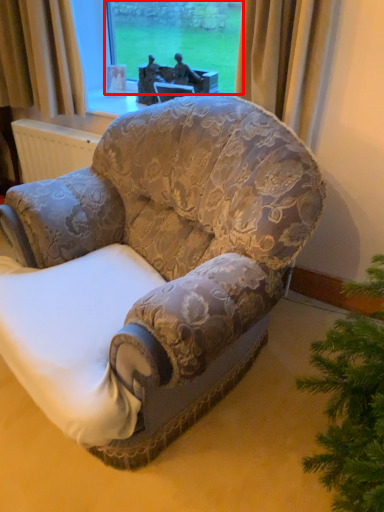
Question: Where is window screen (annotated by the red box) located in relation to chair in the image?

Choices:
 (A) right
 (B) left

Answer: (A)